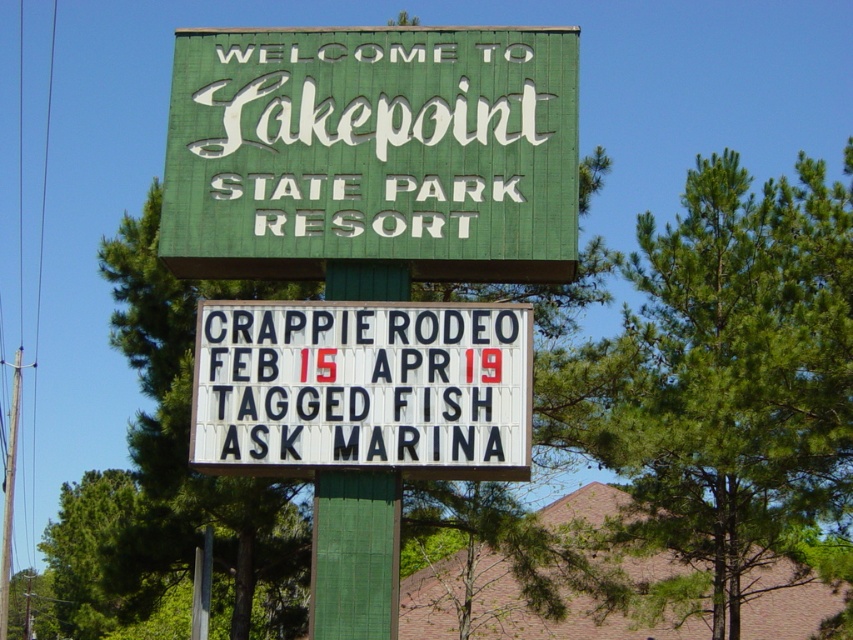
Question: Among these points, which one is nearest to the camera?

Choices:
 (A) (311, 598)
 (B) (469, 330)
 (C) (289, 227)

Answer: (A)

Question: Considering the relative positions of green painted wood signboard at upper center and green painted wood pole at center in the image provided, where is green painted wood signboard at upper center located with respect to green painted wood pole at center?

Choices:
 (A) below
 (B) above

Answer: (B)

Question: Which object is the closest to the green painted wood pole at center?

Choices:
 (A) green painted wood signboard at upper center
 (B) white plastic letters at center

Answer: (B)

Question: Which object is positioned farthest from the green painted wood signboard at upper center?

Choices:
 (A) white plastic letters at center
 (B) green painted wood pole at center

Answer: (B)

Question: Does green painted wood signboard at upper center have a greater width compared to green painted wood pole at center?

Choices:
 (A) no
 (B) yes

Answer: (B)

Question: From the image, what is the correct spatial relationship of green painted wood signboard at upper center in relation to white plastic letters at center?

Choices:
 (A) left
 (B) right

Answer: (B)